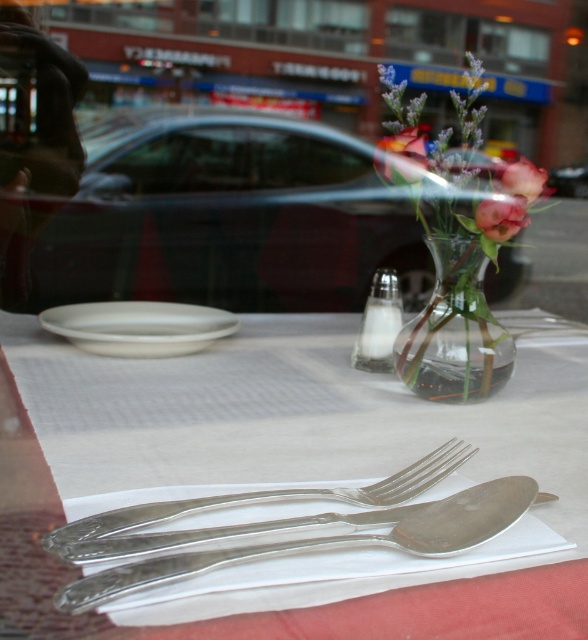
You are standing at the table in the image and want to reach the point at coordinates point (x=211, y=321). If your hand can extend 28 inches, will you be able to reach it?

The point (x=211, y=321) is 30.04 inches from the viewer, which is beyond the hand extension of 28 inches. Therefore, you cannot reach it.

You are a delivery person standing outside the window of the restaurant. You need to place a small package on the table inside the restaurant. The package requires a space that is at least 14 inches away from the viewer. Is the point at coordinate point (422, 490) suitable for placing the package?

The distance between the point at coordinate point (422, 490) and the viewer is 14.42 inches, which meets the requirement of being at least 14 inches away. Therefore, the point is suitable for placing the package.

You are a server in a restaurant and need to place a new menu on the table. The menu is 10 cm wide. You want to place it between the silver metallic cutlery at center and the pink matte flower at center. Can the menu fit in the space between them?

The silver metallic cutlery at center is wider than the pink matte flower at center. Therefore, the space between them may be insufficient for a 10 cm wide menu. Check the actual distance before placing it.